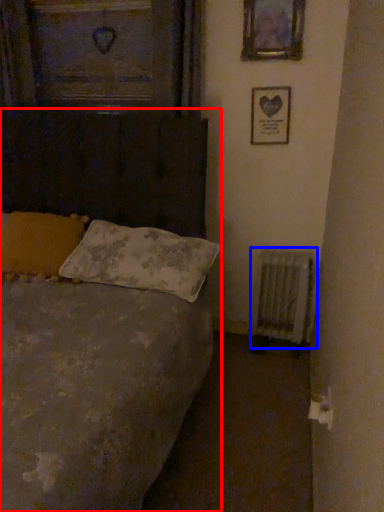
Question: Among these objects, which one is nearest to the camera, bed (highlighted by a red box) or radiator (highlighted by a blue box)?

Choices:
 (A) bed
 (B) radiator

Answer: (A)